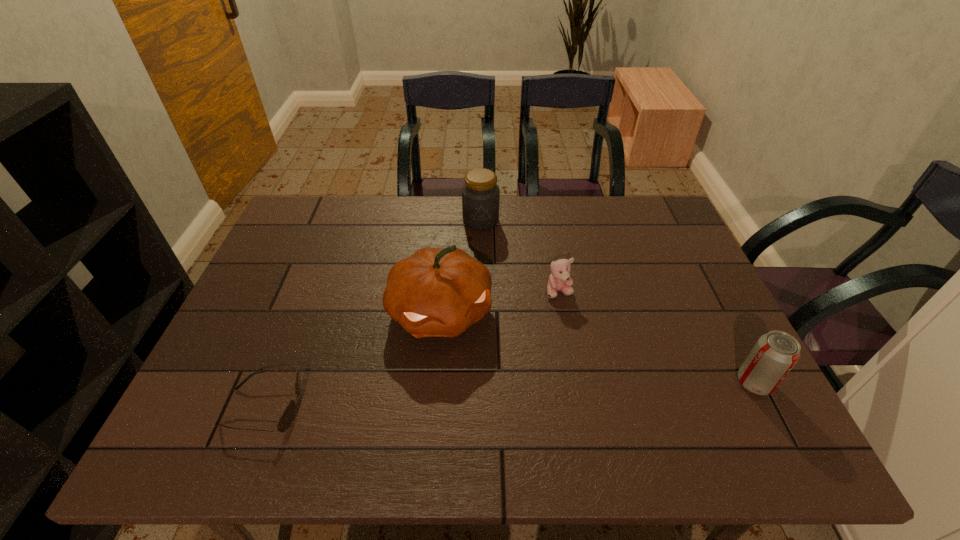
Image resolution: width=960 pixels, height=540 pixels. I want to click on vacant area located 0.070m on the front face of the pumpkin, so click(468, 373).

Locate an element on the screen. The width and height of the screenshot is (960, 540). free spot located 0.100m on the front face of the pumpkin is located at coordinates (472, 383).

Locate an element on the screen. free region located on the front face of the pumpkin is located at coordinates (469, 376).

Find the location of a particular element. This screenshot has width=960, height=540. vacant area situated 0.350m on the surface of the jar near the warning symbol is located at coordinates (474, 315).

The image size is (960, 540). I want to click on vacant space located on the surface of the jar near the warning symbol, so click(x=474, y=321).

Image resolution: width=960 pixels, height=540 pixels. Find the location of `vacant area situated 0.280m on the surface of the jar near the warning symbol`. vacant area situated 0.280m on the surface of the jar near the warning symbol is located at coordinates [x=475, y=295].

This screenshot has width=960, height=540. Find the location of `free space located at the face of the fourth tallest object`. free space located at the face of the fourth tallest object is located at coordinates (568, 389).

Where is `free space located at the face of the fourth tallest object`? The height and width of the screenshot is (540, 960). free space located at the face of the fourth tallest object is located at coordinates (570, 409).

You are a GUI agent. You are given a task and a screenshot of the screen. Output one action in this format:
    pyautogui.click(x=<x>, y=<y>)
    Task: Click on the free region located 0.100m at the face of the fourth tallest object
    
    Given the screenshot: What is the action you would take?
    pyautogui.click(x=563, y=330)

Identify the location of object that is at the far edge. The height and width of the screenshot is (540, 960). (480, 194).